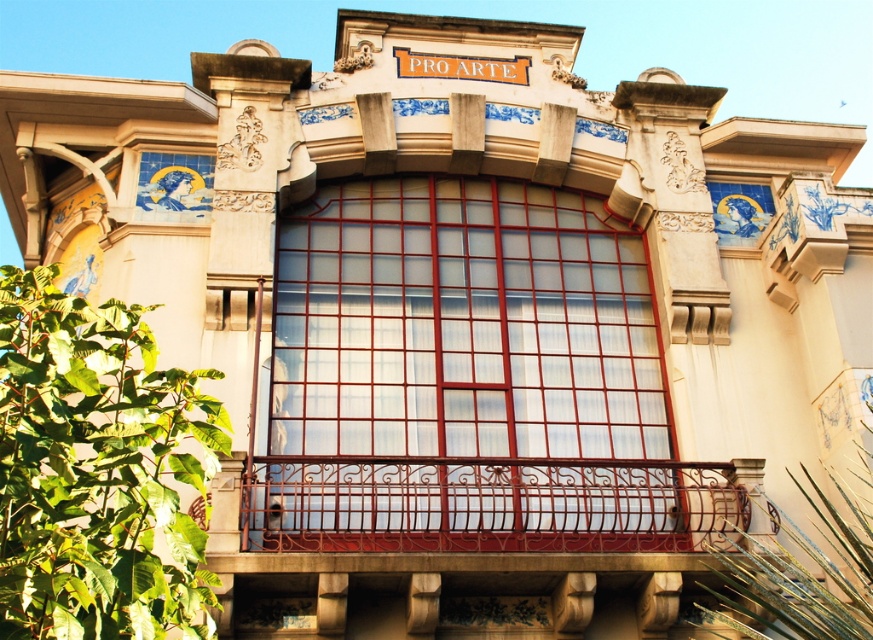
Question: Can you confirm if matte glass window at center is positioned below rusty metal balustrade at center?

Choices:
 (A) yes
 (B) no

Answer: (B)

Question: Which point is farther to the camera?

Choices:
 (A) (443, 250)
 (B) (509, 524)

Answer: (A)

Question: Can you confirm if matte glass window at center is positioned below rusty metal balustrade at center?

Choices:
 (A) yes
 (B) no

Answer: (B)

Question: Can you confirm if matte glass window at center is smaller than rusty metal balustrade at center?

Choices:
 (A) yes
 (B) no

Answer: (B)

Question: Which object is farther from the camera taking this photo?

Choices:
 (A) matte glass window at center
 (B) rusty metal balustrade at center

Answer: (A)